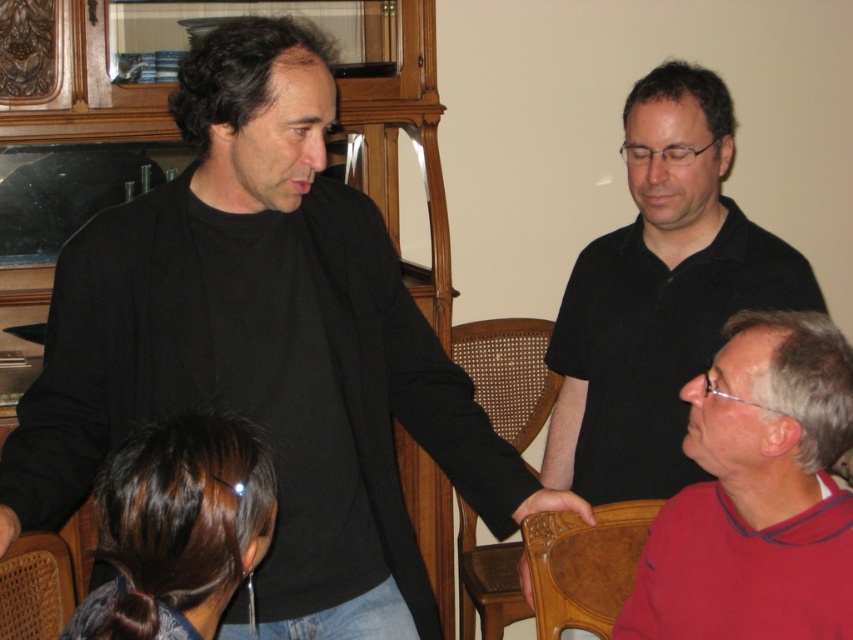
Question: Does black matte shirt at center appear over beech wood chair at lower center?

Choices:
 (A) no
 (B) yes

Answer: (B)

Question: Based on their relative distances, which object is nearer to the red matte sweater at lower right?

Choices:
 (A) brown woven chair at lower left
 (B) black matte shirt at center
 (C) beech wood chair at lower center

Answer: (C)

Question: Which of the following is the farthest from the observer?

Choices:
 (A) (634, 508)
 (B) (294, 538)

Answer: (A)

Question: Is woven wood chair at center further to the viewer compared to beech wood chair at lower center?

Choices:
 (A) no
 (B) yes

Answer: (B)

Question: Is woven wood chair at center thinner than brown woven chair at lower left?

Choices:
 (A) yes
 (B) no

Answer: (B)

Question: Which of the following is the closest to the observer?

Choices:
 (A) (468, 593)
 (B) (317, 481)

Answer: (B)